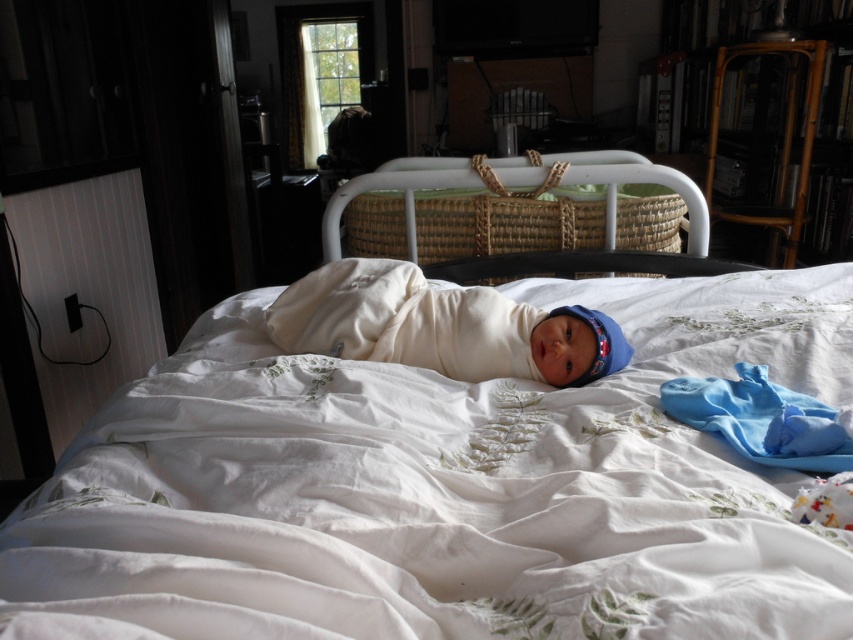
Does white embroidered sheet at center have a lesser height compared to bamboo bookshelf at upper right?

Yes.

Is white embroidered sheet at center wider than bamboo bookshelf at upper right?

Yes, white embroidered sheet at center is wider than bamboo bookshelf at upper right.

Between point (473, 596) and point (838, 88), which one is positioned behind?

The point (838, 88) is more distant.

Find the location of a particular element. Image resolution: width=853 pixels, height=640 pixels. white embroidered sheet at center is located at coordinates (442, 488).

Based on the photo, does bamboo bookshelf at upper right have a greater width compared to woven wicker bassinet at center?

In fact, bamboo bookshelf at upper right might be narrower than woven wicker bassinet at center.

This screenshot has height=640, width=853. Describe the element at coordinates (770, 116) in the screenshot. I see `bamboo bookshelf at upper right` at that location.

Locate an element on the screen. This screenshot has width=853, height=640. bamboo bookshelf at upper right is located at coordinates (770, 116).

What do you see at coordinates (770, 116) in the screenshot?
I see `bamboo bookshelf at upper right` at bounding box center [770, 116].

Based on the photo, which is above, bamboo bookshelf at upper right or white soft swaddle at center?

bamboo bookshelf at upper right is higher up.

Measure the distance between bamboo bookshelf at upper right and camera.

bamboo bookshelf at upper right and camera are 2.34 meters apart from each other.

The width and height of the screenshot is (853, 640). Find the location of `bamboo bookshelf at upper right`. bamboo bookshelf at upper right is located at coordinates (770, 116).